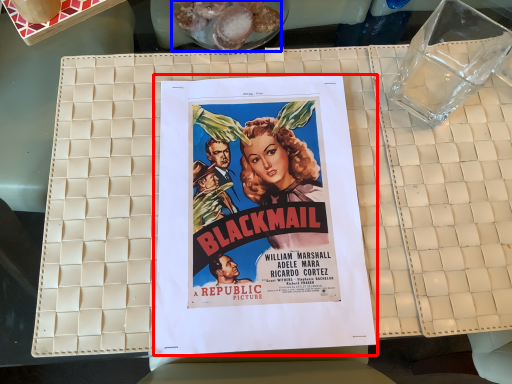
Question: Which object appears closest to the camera in this image, poster (highlighted by a red box) or food (highlighted by a blue box)?

Choices:
 (A) poster
 (B) food

Answer: (A)